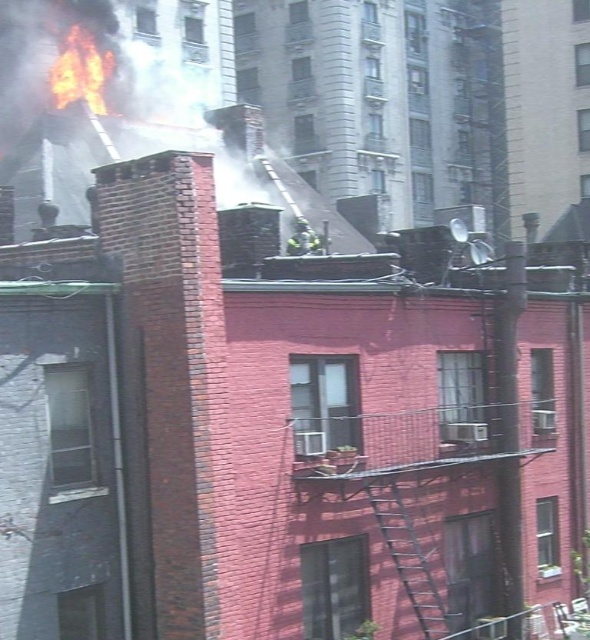
Question: Where is white smoke at upper center located in relation to flaming orange flames at upper left in the image?

Choices:
 (A) left
 (B) right

Answer: (B)

Question: Which point is closer to the camera?

Choices:
 (A) metallic silver ladder at center
 (B) green reflective uniform at center
 (C) white smoke at upper center

Answer: (A)

Question: Is white smoke at upper center positioned before metallic silver ladder at center?

Choices:
 (A) yes
 (B) no

Answer: (B)

Question: Can you confirm if metallic silver ladder at center is positioned to the left of green reflective uniform at center?

Choices:
 (A) yes
 (B) no

Answer: (B)

Question: Which is farther from the white smoke at upper center?

Choices:
 (A) flaming orange flames at upper left
 (B) metallic silver ladder at center

Answer: (B)

Question: Which point is closer to the camera?

Choices:
 (A) (296, 252)
 (B) (109, 51)
 (C) (399, 532)

Answer: (C)